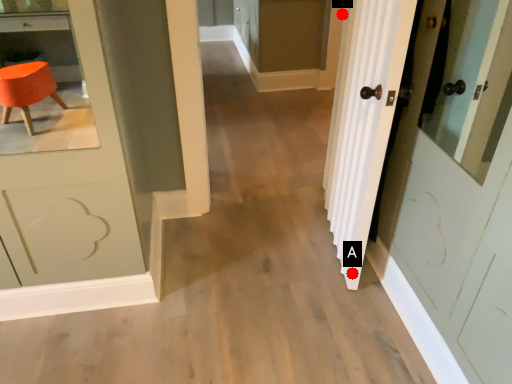
Question: Two points are circled on the image, labeled by A and B beside each circle. Which point is farther to the camera?

Choices:
 (A) A is further
 (B) B is further

Answer: (B)